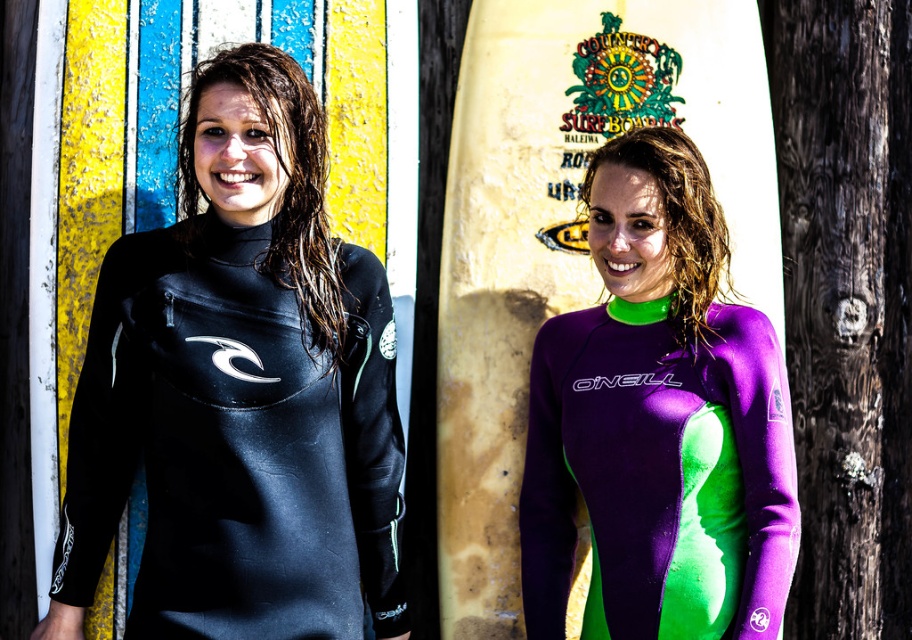
Question: Among these objects, which one is farthest from the camera?

Choices:
 (A) yellow matte surfboard at center
 (B) black neoprene wetsuit at left
 (C) purple/green neoprene wetsuit at center

Answer: (C)

Question: Does black neoprene wetsuit at left appear under purple/green neoprene wetsuit at center?

Choices:
 (A) yes
 (B) no

Answer: (A)

Question: Which point is farther from the camera taking this photo?

Choices:
 (A) (216, 506)
 (B) (789, 440)

Answer: (B)

Question: Which point is farther from the camera taking this photo?

Choices:
 (A) (203, 166)
 (B) (778, 362)
 (C) (446, 627)

Answer: (B)

Question: Does yellow matte surfboard at center have a lesser width compared to purple/green neoprene wetsuit at center?

Choices:
 (A) no
 (B) yes

Answer: (A)

Question: Is yellow matte surfboard at center behind purple/green neoprene wetsuit at center?

Choices:
 (A) yes
 (B) no

Answer: (B)